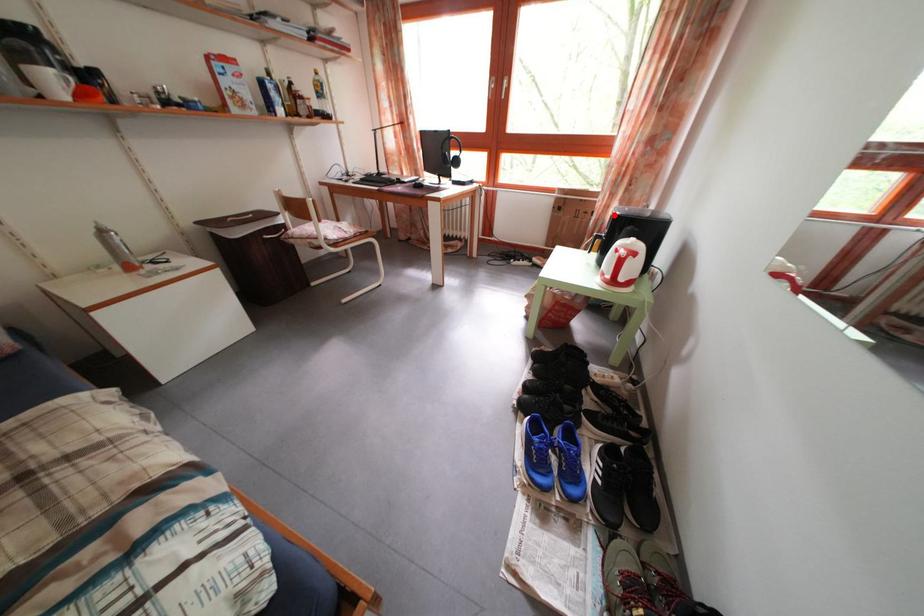
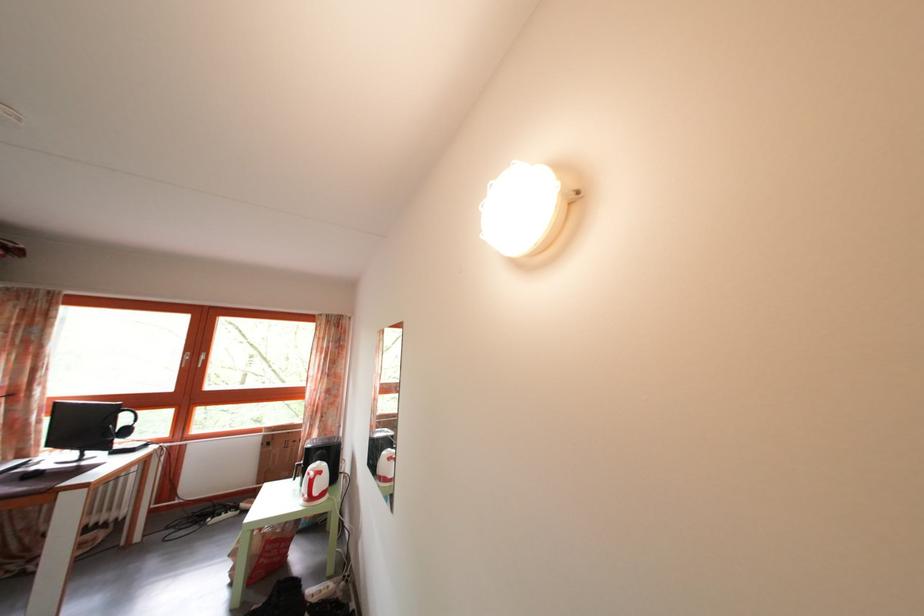
Locate, in the second image, the point that corresponds to the highlighted location in the first image.

(317, 442)